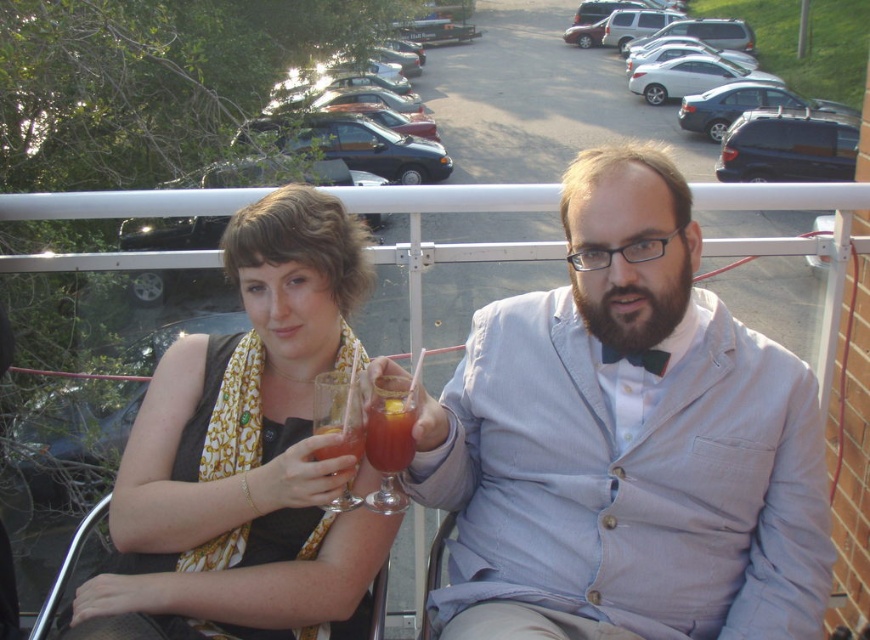
You are a bartender preparing drinks for two people. You have two translucent glasses available. The first is labeled as the translucent glass at center, and the second is the translucent glass beverage at center. Based on the scene description, which glass should you choose to ensure the drink doesn not overflow when filled to the brim?

The translucent glass at center is taller than the translucent glass beverage at center, so you should choose the translucent glass at center to prevent the drink from overflowing when filled to the brim.

Consider the image. You are standing at the balcony looking out. There is a blue metallic minivan at upper right and a translucent glass beverage at center. Which object is located to the right side of the other?

The blue metallic minivan at upper right is located to the right of the translucent glass beverage at center.

You are standing in front of the balcony scene. There is a matte gold scarf at center. If you want to pick it up without moving your feet, can you reach it?

The matte gold scarf at center is 1.44 meters away from the viewer. Since the average human arm span is about 1.5 meters, you can likely reach it without moving your feet.